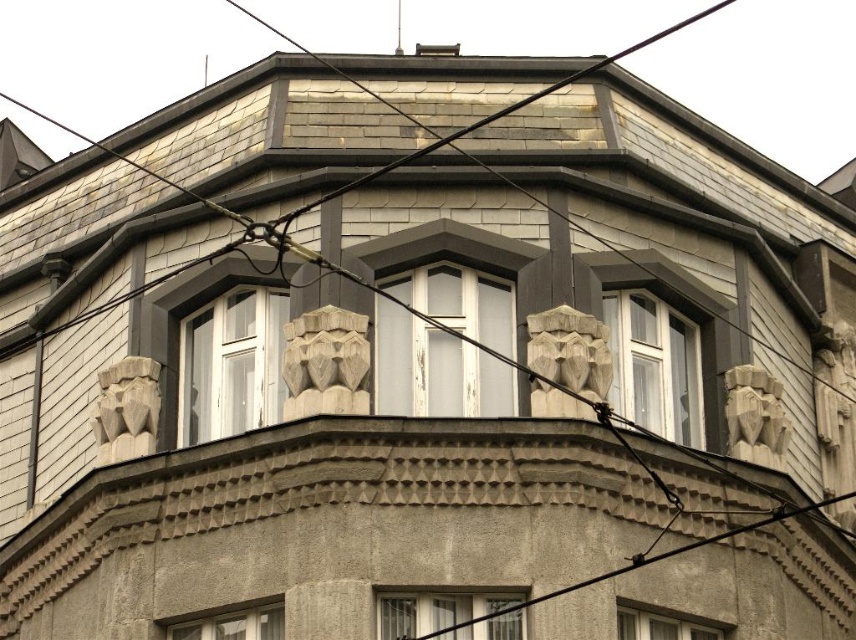
Is point (470, 394) positioned in front of point (110, 420)?

Yes, it is in front of point (110, 420).

Is transparent glass window at center to the right of gray stone lion head at left from the viewer's perspective?

Correct, you'll find transparent glass window at center to the right of gray stone lion head at left.

Identify the location of transparent glass window at center. Image resolution: width=856 pixels, height=640 pixels. (434, 371).

Looking at this image, is white glass window at center thinner than matte gray window at lower center?

Indeed, white glass window at center has a lesser width compared to matte gray window at lower center.

Can you confirm if white glass window at center is bigger than matte gray window at lower center?

Yes.

What do you see at coordinates (232, 364) in the screenshot? I see `white glass window at center` at bounding box center [232, 364].

Identify the location of white glass window at center. (232, 364).

Who is more distant from viewer, (322,339) or (599,346)?

The point (599,346) is more distant.

Which is more to the left, carved stone lion head at center or gray stone sculpture at center?

From the viewer's perspective, carved stone lion head at center appears more on the left side.

This screenshot has width=856, height=640. I want to click on carved stone lion head at center, so click(325, 364).